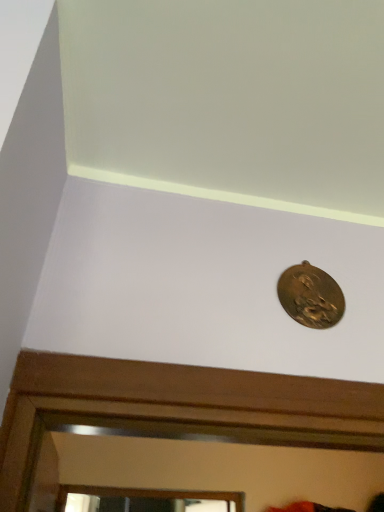
The width and height of the screenshot is (384, 512). Describe the element at coordinates (310, 296) in the screenshot. I see `gold metallic coin at upper center` at that location.

The image size is (384, 512). Identify the location of gold metallic coin at upper center. (310, 296).

Find the location of a particular element. gold metallic coin at upper center is located at coordinates (310, 296).